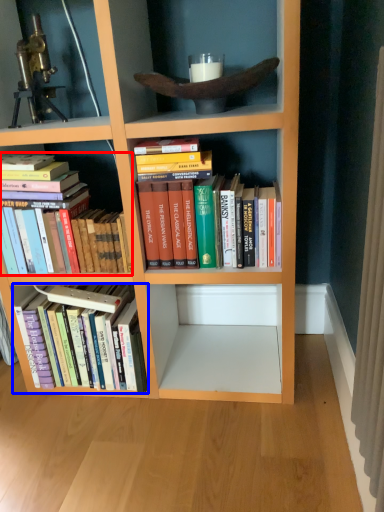
Question: Among these objects, which one is farthest to the camera, book (highlighted by a red box) or book (highlighted by a blue box)?

Choices:
 (A) book
 (B) book

Answer: (B)